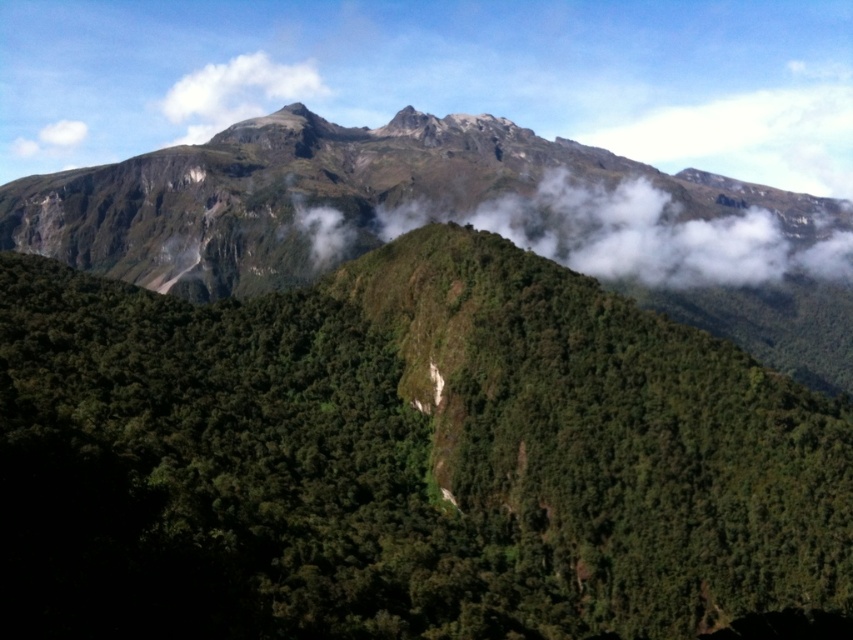
You are an observer looking at the mountain landscape. You notice the green leafy hillside at center and the white fluffy cloud at center. Which object is positioned to the left side of the other?

The green leafy hillside at center is to the left of the white fluffy cloud at center.